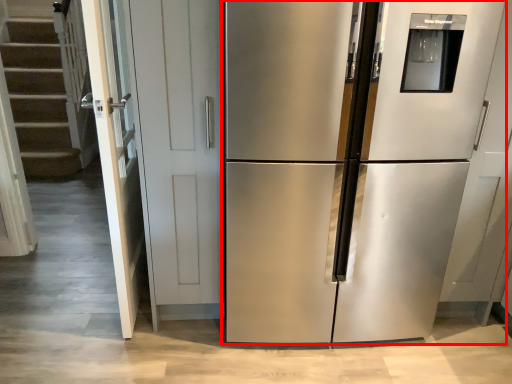
Question: From the image's perspective, where is refrigerator (annotated by the red box) located in relation to door in the image?

Choices:
 (A) below
 (B) above

Answer: (A)